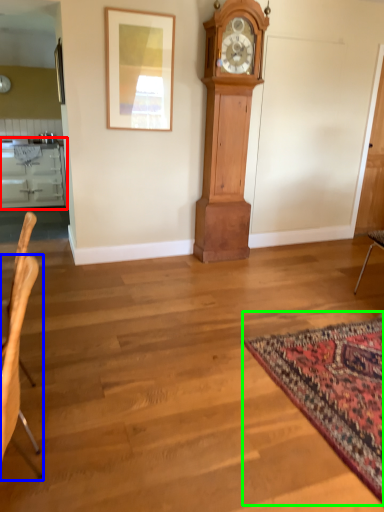
Question: Estimate the real-world distances between objects in this image. Which object is farther from cabinetry (highlighted by a red box), chair (highlighted by a blue box) or mat (highlighted by a green box)?

Choices:
 (A) chair
 (B) mat

Answer: (B)